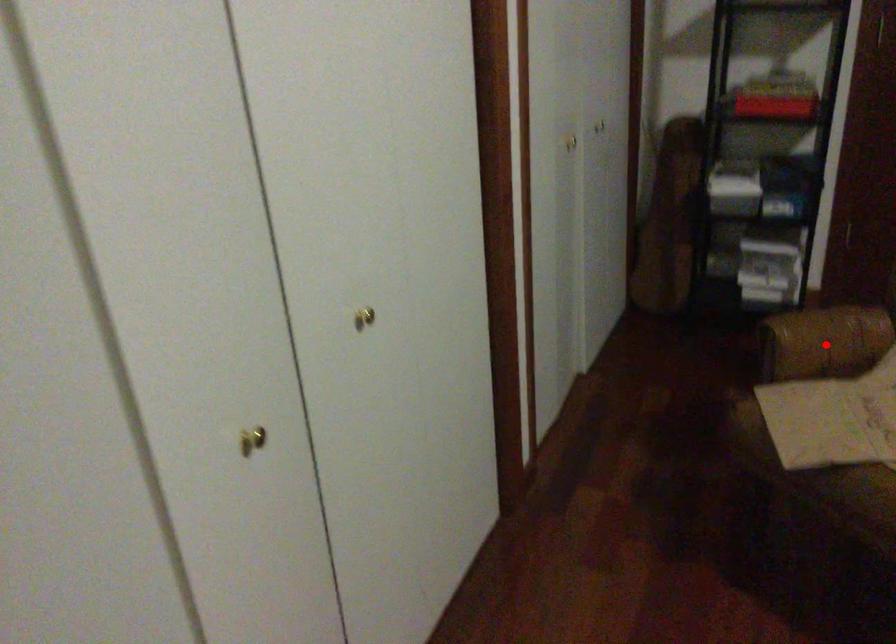
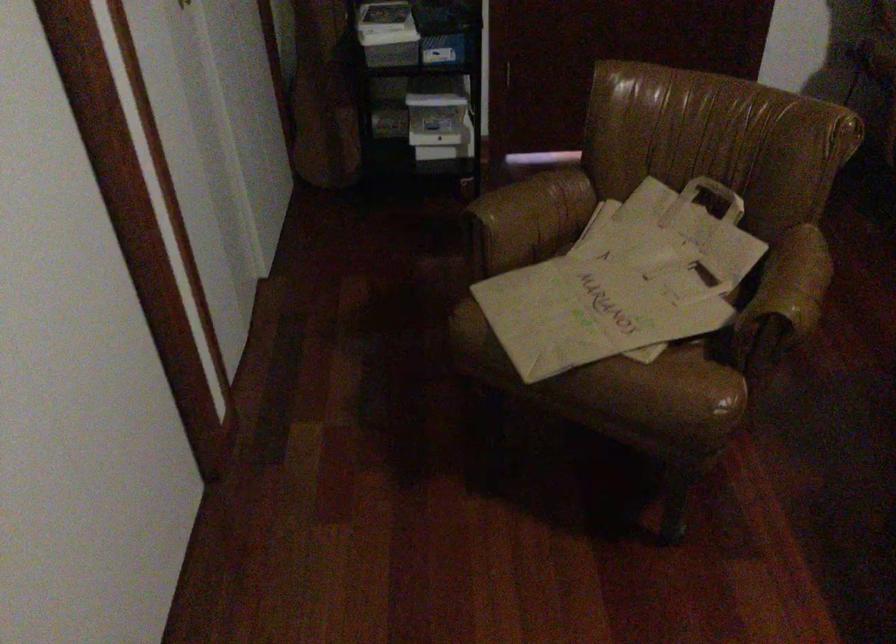
Locate, in the second image, the point that corresponds to the highlighted location in the first image.

(532, 216)